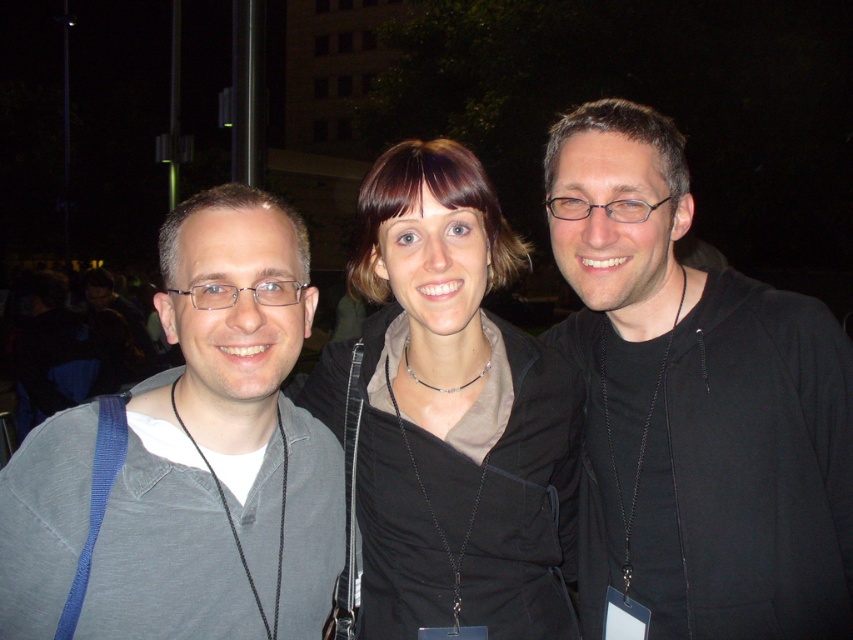
You are a photographer trying to capture a group photo of the gray cotton shirt at left and the black matte jacket at center. Since you want to ensure both subjects are in focus, you need to know their relative positions. Which one is located more to the left?

The gray cotton shirt at left is positioned on the left side of black matte jacket at center, so the gray cotton shirt at left is more to the left.

You are a photographer trying to capture a clear photo of both the black matte jacket at right and the black matte jacket at center. However, the lighting is too dim. Which jacket is more likely to be in focus if you adjust the camera to focus on the one closer to the front?

The black matte jacket at right is positioned over the black matte jacket at center, so focusing on the one closer to the front would mean the black matte jacket at right is more likely to be in focus.